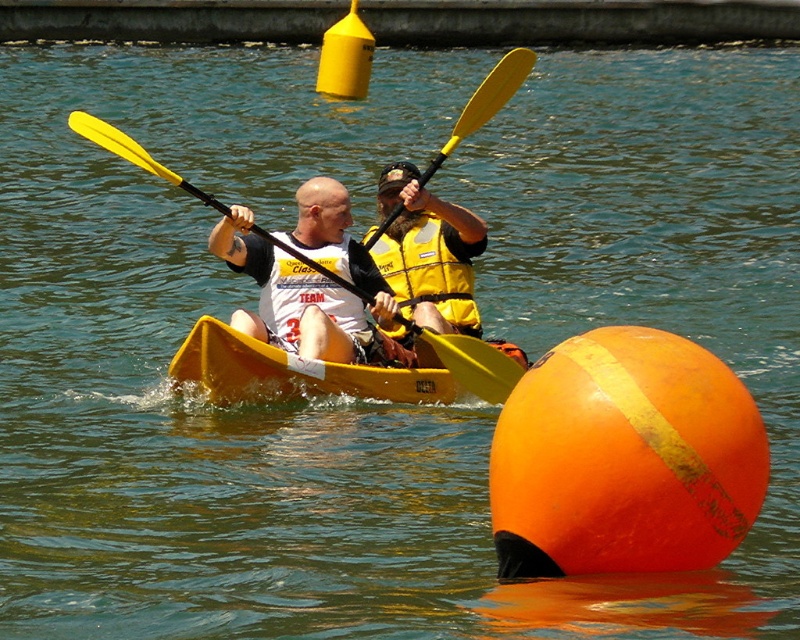
Can you confirm if white matte shirt at center is bigger than yellow matte paddle at center?

Actually, white matte shirt at center might be smaller than yellow matte paddle at center.

Consider the image. Is white matte shirt at center thinner than yellow matte paddle at center?

Yes.

Is point (396, 308) positioned behind point (422, 330)?

Yes, point (396, 308) is behind point (422, 330).

This screenshot has height=640, width=800. Find the location of `white matte shirt at center`. white matte shirt at center is located at coordinates (297, 300).

Can you confirm if white matte shirt at center is shorter than yellow matte life jacket at center?

In fact, white matte shirt at center may be taller than yellow matte life jacket at center.

Does white matte shirt at center have a smaller size compared to yellow matte life jacket at center?

Incorrect, white matte shirt at center is not smaller in size than yellow matte life jacket at center.

You are a GUI agent. You are given a task and a screenshot of the screen. Output one action in this format:
    pyautogui.click(x=<x>, y=<y>)
    Task: Click on the white matte shirt at center
    
    Given the screenshot: What is the action you would take?
    297,300

Identify the location of white matte shirt at center. This screenshot has height=640, width=800. (297, 300).

Between point (424, 300) and point (501, 365), which one is positioned in front?

Positioned in front is point (501, 365).

Between point (430, 260) and point (310, 262), which one is positioned in front?

Positioned in front is point (310, 262).

Where is `yellow matte life jacket at center`? This screenshot has height=640, width=800. yellow matte life jacket at center is located at coordinates (430, 268).